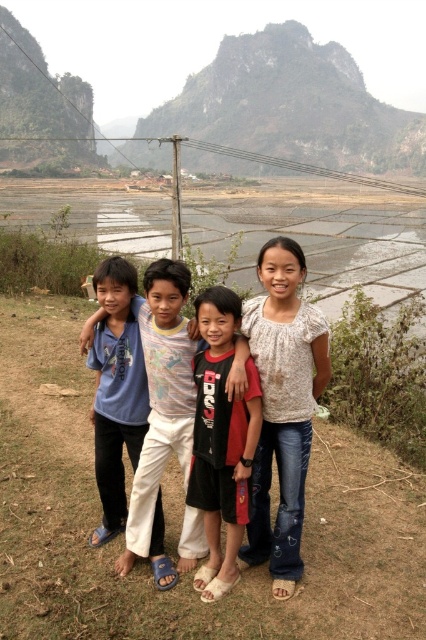
Question: Estimate the real-world distances between objects in this image. Which object is closer to the rocky gray mountain at upper center?

Choices:
 (A) white textured blouse at center
 (B) brown grassy dirt field at center
 (C) black cotton t-shirt at center
 (D) rugged stone mountain at upper left

Answer: (D)

Question: Which object appears closest to the camera in this image?

Choices:
 (A) brown grassy dirt field at center
 (B) rocky gray mountain at upper center
 (C) light blue t-shirt at center

Answer: (A)

Question: Does black cotton t-shirt at center appear under rugged stone mountain at upper left?

Choices:
 (A) yes
 (B) no

Answer: (A)

Question: Which of the following is the farthest from the observer?

Choices:
 (A) rugged stone mountain at upper left
 (B) blue cotton shirt at center

Answer: (A)

Question: Does light blue t-shirt at center appear under blue cotton shirt at center?

Choices:
 (A) yes
 (B) no

Answer: (A)

Question: Is blue cotton shirt at center further to camera compared to rugged stone mountain at upper left?

Choices:
 (A) no
 (B) yes

Answer: (A)